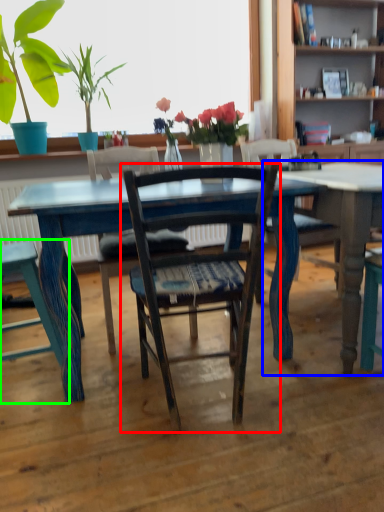
Question: Considering the real-world distances, which object is farthest from chair (highlighted by a red box)? table (highlighted by a blue box) or chair (highlighted by a green box)?

Choices:
 (A) table
 (B) chair

Answer: (B)